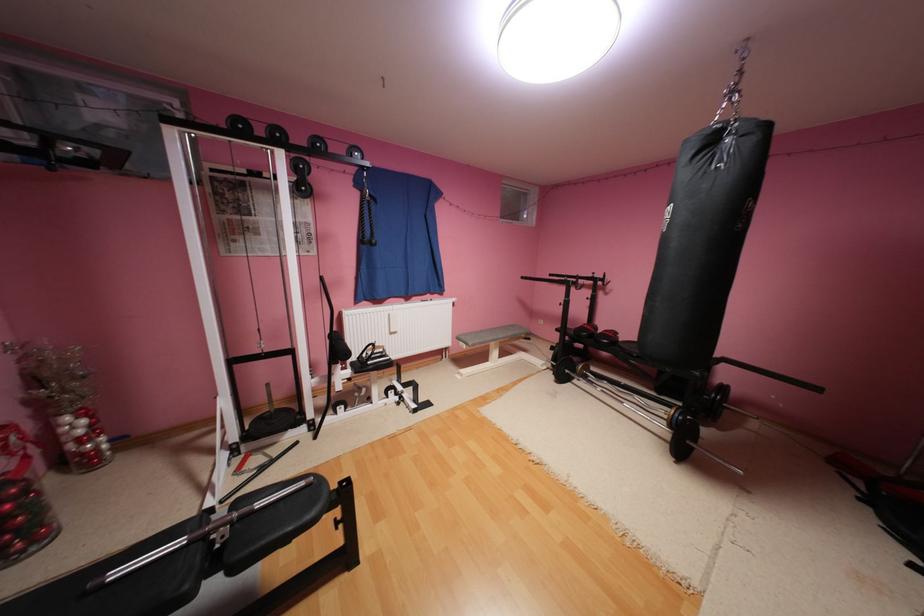
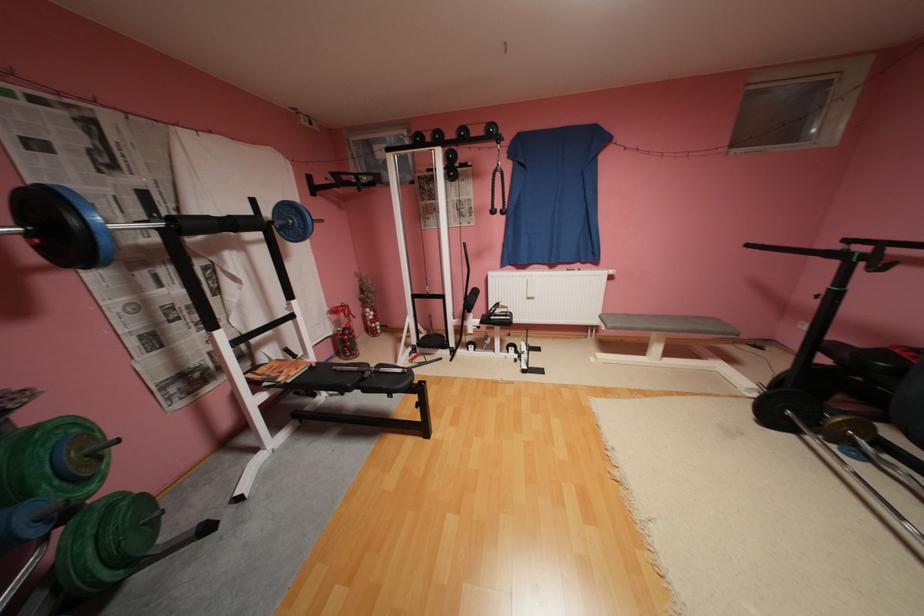
In the second image, find the point that corresponds to pixel 531 278 in the first image.

(757, 246)